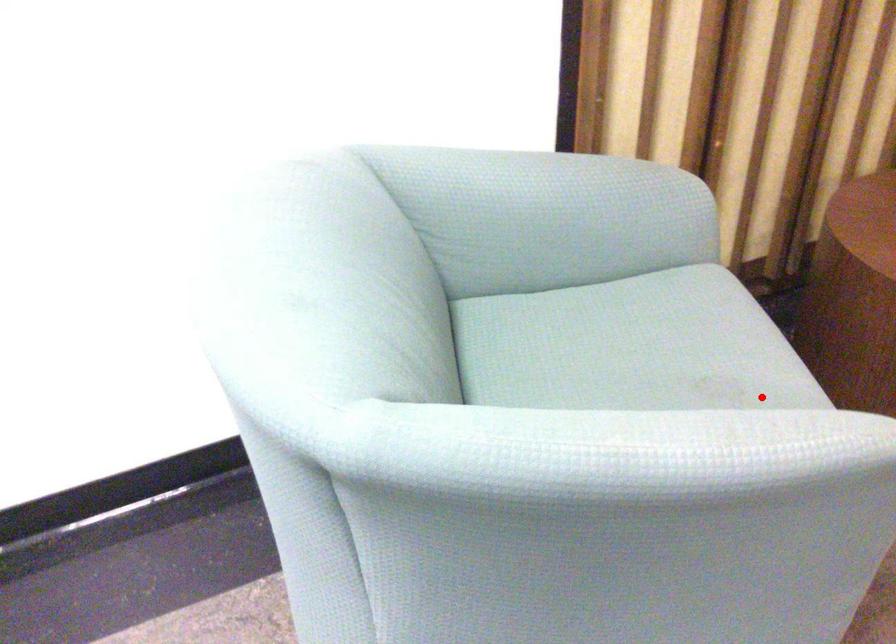
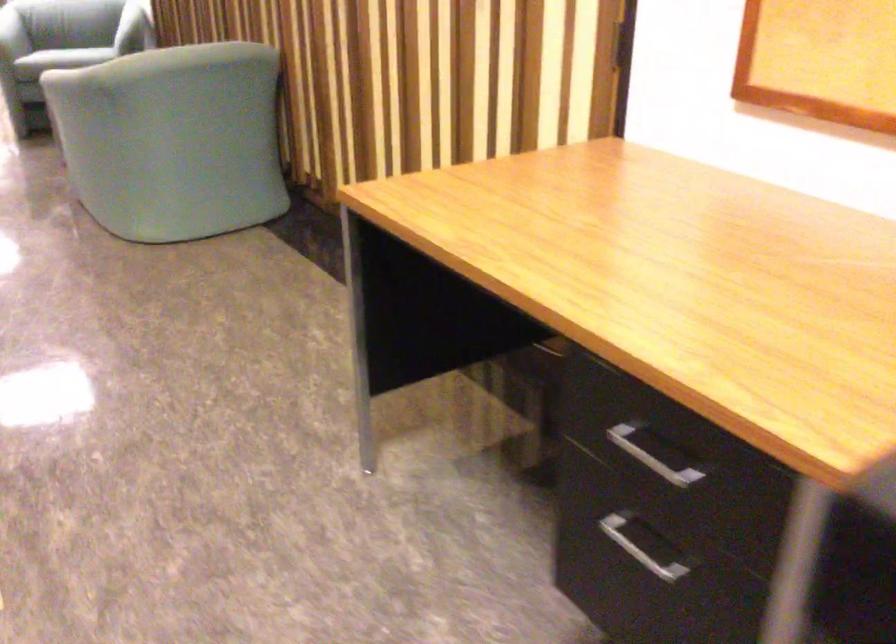
Locate, in the second image, the point that corresponds to the highlighted location in the first image.

(12, 35)